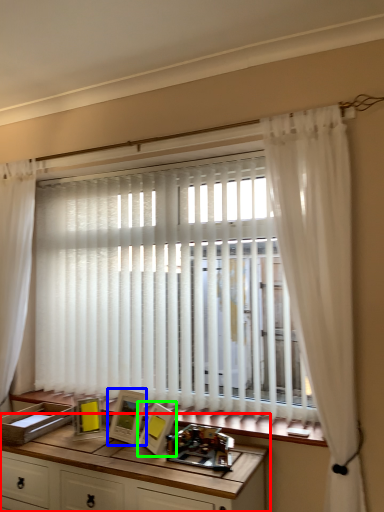
Question: Which object is the farthest from table (highlighted by a red box)? Choose among these: picture frame (highlighted by a blue box) or picture frame (highlighted by a green box).

Choices:
 (A) picture frame
 (B) picture frame

Answer: (B)